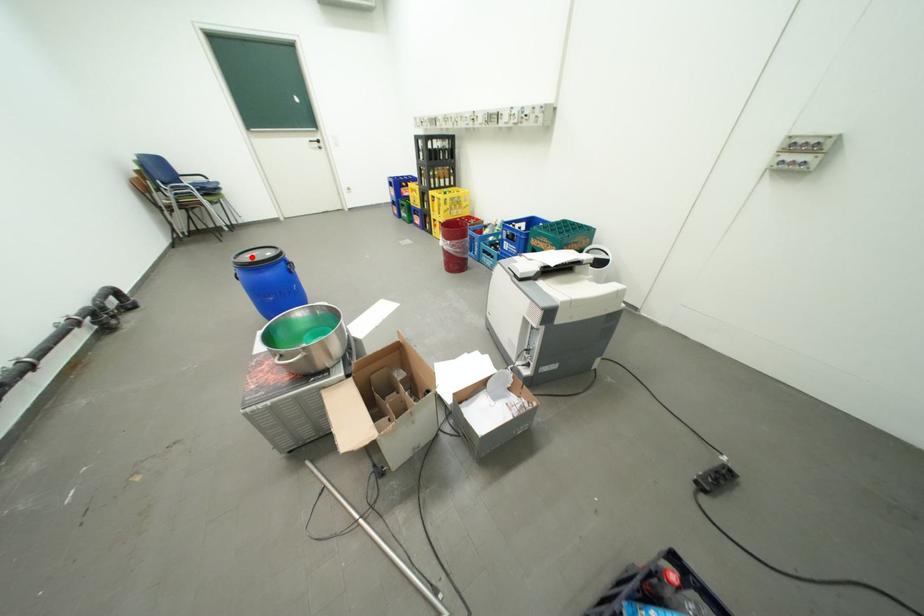
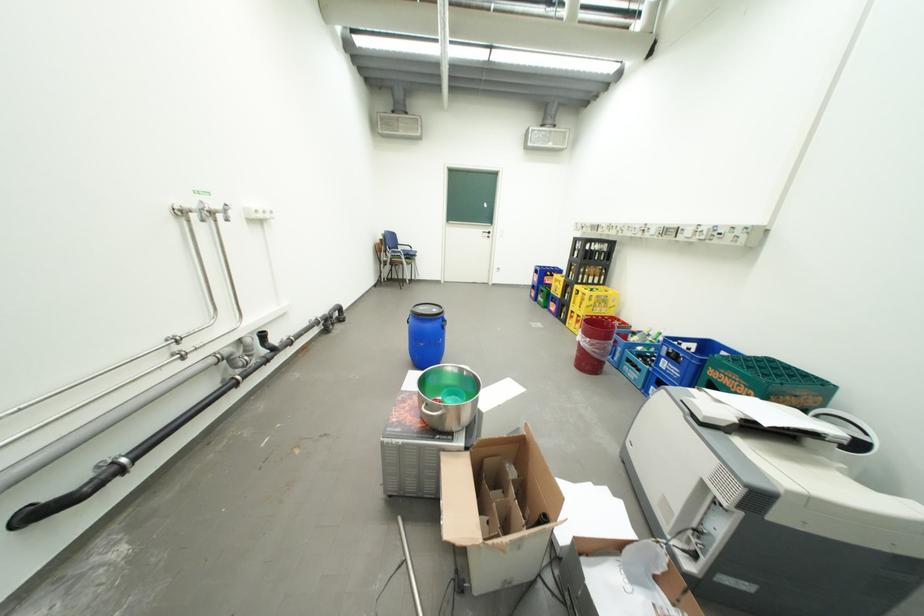
Locate, in the second image, the point that corresponds to the highlighted location in the first image.

(428, 309)